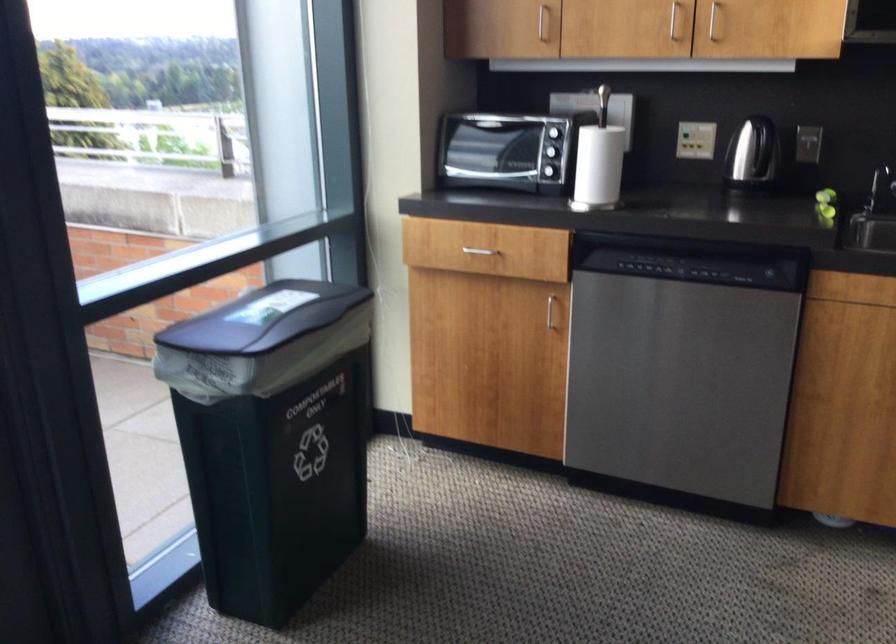
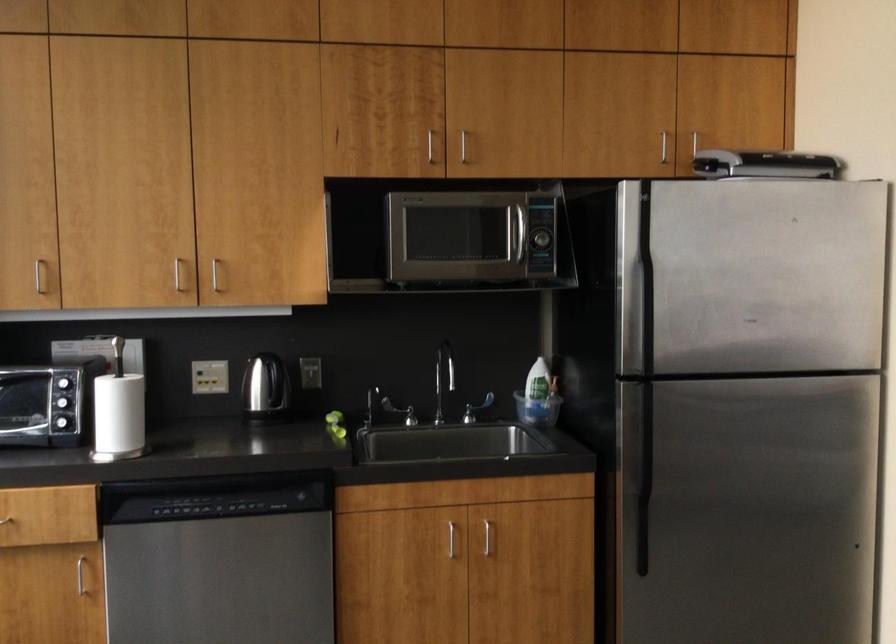
Find the pixel in the second image that matches (661,228) in the first image.

(208, 471)